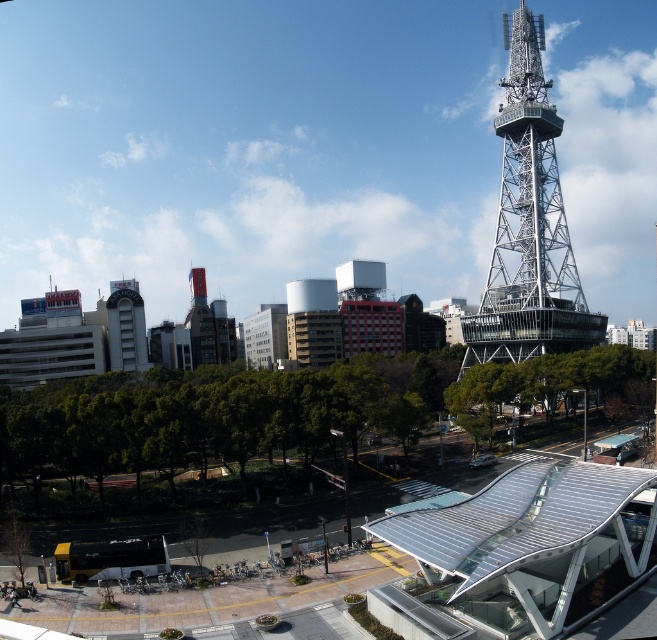
Based on the photo, you are standing at point A located at point (526, 355) and want to walk to point B which is 397.37 feet away. The path between them is a straight line. Given that the plaza has a maximum allowed walking speed of 3 feet per second, how many seconds will it take you to reach point B?

The distance between point A at point (526, 355) and point B is 397.37 feet. At a speed of 3 feet per second, the time required is 397.37 divided by 3, which equals approximately 132.46 seconds.

Looking at this image, you are standing in the plaza area and want to take a photo of both the metallic lattice tower at upper right and the white concrete building at left. Based on their positions, which direction should you face to ensure both are visible in the frame?

You should face towards the center of the plaza area so that both the metallic lattice tower at upper right to the right and the white concrete building at left are visible in your frame.

You are a city planner evaluating the urban layout. Considering the scale of the metallic lattice tower at upper right and the white concrete building at left, which one would require more space for construction? Please explain your reasoning based on their sizes.

The metallic lattice tower at upper right requires more space for construction because it has a larger size compared to the white concrete building at left.